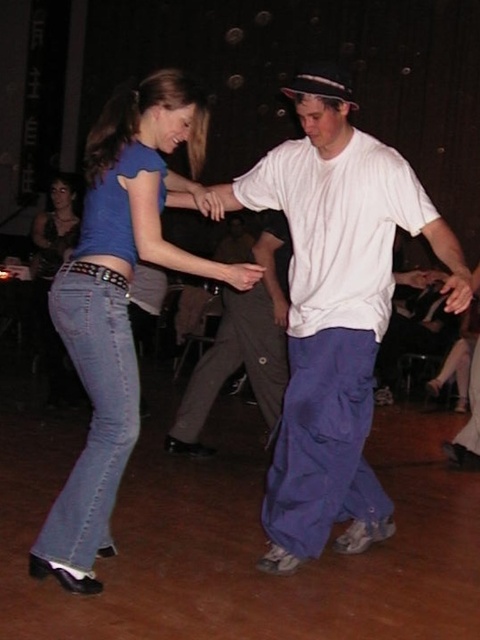
Question: Is white cotton shirt at center to the right of denim jeans at lower left from the viewer's perspective?

Choices:
 (A) yes
 (B) no

Answer: (A)

Question: Can you confirm if blue cotton pants at center is positioned to the right of denim jeans at lower left?

Choices:
 (A) yes
 (B) no

Answer: (A)

Question: Which of the following is the farthest from the observer?

Choices:
 (A) (94, 444)
 (B) (33, 280)
 (C) (278, 387)
 (D) (139, 202)

Answer: (B)

Question: Does blue cotton pants at center appear over denim jeans at lower left?

Choices:
 (A) yes
 (B) no

Answer: (B)

Question: Which point appears farthest from the camera in this image?

Choices:
 (A) (376, 536)
 (B) (95, 339)

Answer: (A)

Question: Which object is the farthest from the dark gray pants at center?

Choices:
 (A) denim jeans at lower left
 (B) white cotton shirt at center

Answer: (A)